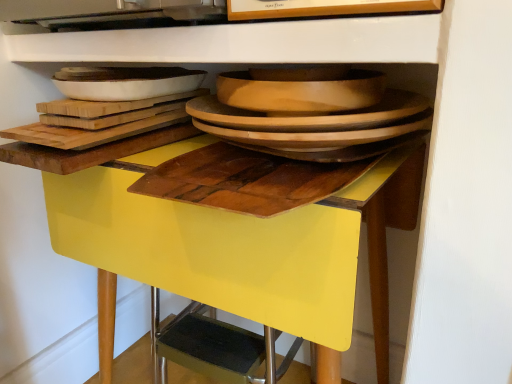
Question: In terms of height, does yellow glossy table at center look taller or shorter compared to wooden cutting board at center?

Choices:
 (A) tall
 (B) short

Answer: (A)

Question: In the image, is yellow glossy table at center on the left side or the right side of wooden cutting board at center?

Choices:
 (A) left
 (B) right

Answer: (A)

Question: Estimate the real-world distances between objects in this image. Which object is farther from the yellow glossy table at center?

Choices:
 (A) white glossy platter at upper left, which is the 2th platter from right to left
 (B) wooden cutting board at center
 (C) wooden platter at center, acting as the 1th platter starting from the right

Answer: (A)

Question: Which is farther from the yellow glossy table at center?

Choices:
 (A) wooden cutting board at center
 (B) wooden platter at center, the second platter in the left-to-right sequence
 (C) white glossy platter at upper left, which is the 2th platter from right to left

Answer: (C)